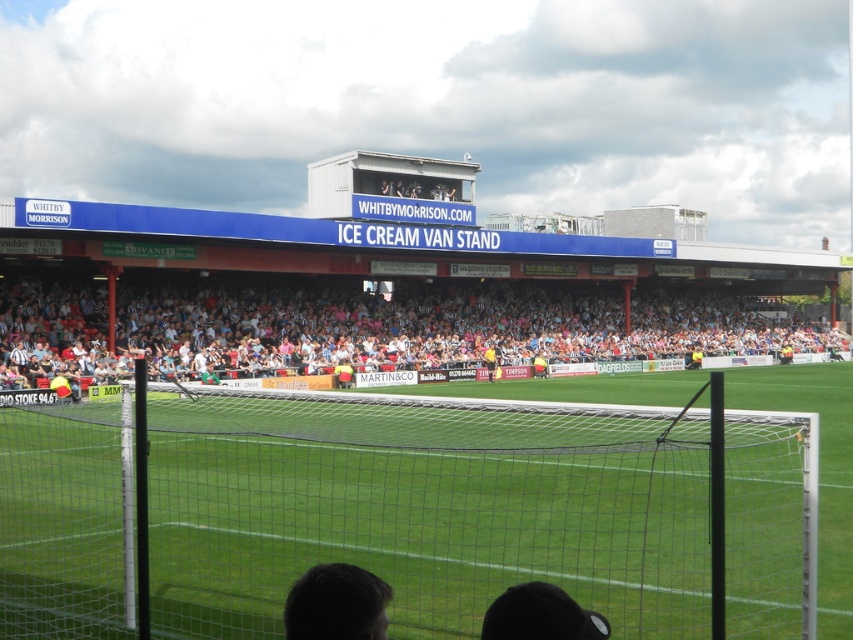
You are a spectator at the football stadium looking for your seat. You see the white plastic seats at center and the yellow jersey at center. Which object is higher from the ground?

The white plastic seats at center are located above the yellow jersey at center, so the white plastic seats at center are higher from the ground.

You are a photographer positioned at the edge of the football field. You want to take a photo of the yellow jersey at center without the green netting at center blocking the view. Is this possible given their positions?

The green netting at center is closer to the viewer than the yellow jersey at center, so the green netting at center would block the view of the yellow jersey at center. Therefore, it is not possible to take a photo of the yellow jersey at center without the green netting at center blocking the view.

You are a photographer positioned at the center of the football stadium. You notice a person with dark brown hair at lower center and want to capture them in your shot. Given the stadium layout described, where should you aim your camera relative to the goalpost net to include both the person and the net in the frame?

The dark brown hair at lower center is located at point [335,604], which is towards the lower right side of the image. To include both the person and the goalpost net in your shot, aim your camera slightly to the right of the net, ensuring the lower right area is within the frame.